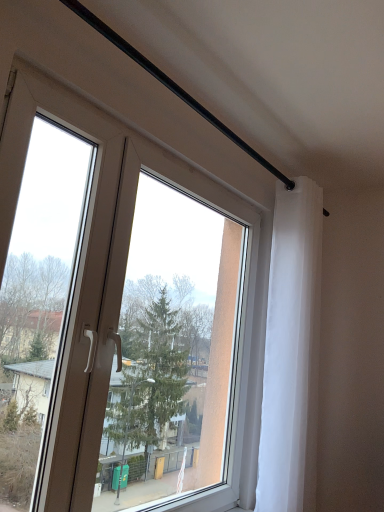
Measure the distance between transparent glass window at center and camera.

The distance of transparent glass window at center from camera is 1.08 meters.

Image resolution: width=384 pixels, height=512 pixels. Identify the location of transparent glass window at center. (122, 284).

What do you see at coordinates (122, 284) in the screenshot? I see `transparent glass window at center` at bounding box center [122, 284].

Based on the photo, what is the approximate width of transparent glass window at center?

transparent glass window at center is 4.57 inches in width.

Describe the element at coordinates (291, 353) in the screenshot. I see `white sheer curtain at upper right` at that location.

Where is `white sheer curtain at upper right`? The image size is (384, 512). white sheer curtain at upper right is located at coordinates (291, 353).

Measure the distance between white sheer curtain at upper right and camera.

white sheer curtain at upper right and camera are 5.76 feet apart from each other.

Image resolution: width=384 pixels, height=512 pixels. Identify the location of transparent glass window at center. (122, 284).

Is white sheer curtain at upper right to the left or to the right of transparent glass window at center in the image?

white sheer curtain at upper right is to the right of transparent glass window at center.

Is white sheer curtain at upper right in front of or behind transparent glass window at center in the image?

white sheer curtain at upper right is behind transparent glass window at center.

Does point (310, 497) lie in front of point (249, 331)?

No, it is behind (249, 331).

From the image's perspective, is white sheer curtain at upper right beneath transparent glass window at center?

Yes, from the image's perspective, white sheer curtain at upper right is beneath transparent glass window at center.

Looking at this image, from a real-world perspective, who is located higher, white sheer curtain at upper right or transparent glass window at center?

white sheer curtain at upper right, from a real-world perspective.

Considering the relative sizes of white sheer curtain at upper right and transparent glass window at center in the image provided, is white sheer curtain at upper right thinner than transparent glass window at center?

No.

Which of these two, white sheer curtain at upper right or transparent glass window at center, stands shorter?

transparent glass window at center.

Looking at the image, does white sheer curtain at upper right seem bigger or smaller compared to transparent glass window at center?

white sheer curtain at upper right is smaller than transparent glass window at center.

Is white sheer curtain at upper right not within transparent glass window at center?

That's correct, white sheer curtain at upper right is outside of transparent glass window at center.

Is white sheer curtain at upper right beside transparent glass window at center?

white sheer curtain at upper right is not next to transparent glass window at center, and they're not touching.

Consider the image. Is transparent glass window at center at the back of white sheer curtain at upper right?

No, white sheer curtain at upper right's orientation is not away from transparent glass window at center.

Find the location of a particular element. window on the left of white sheer curtain at upper right is located at coordinates (122, 284).

Which is more to the left, transparent glass window at center or white sheer curtain at upper right?

transparent glass window at center is more to the left.

From the picture: Is transparent glass window at center behind white sheer curtain at upper right?

No, it is not.

Is point (206, 197) closer or farther from the camera than point (292, 455)?

Point (206, 197) appears to be farther away from the viewer than point (292, 455).

From the image's perspective, relative to white sheer curtain at upper right, is transparent glass window at center above or below?

transparent glass window at center is above white sheer curtain at upper right.

From a real-world perspective, is transparent glass window at center positioned over white sheer curtain at upper right based on gravity?

No.

Does transparent glass window at center have a greater width compared to white sheer curtain at upper right?

No, transparent glass window at center is not wider than white sheer curtain at upper right.

Can you confirm if transparent glass window at center is taller than white sheer curtain at upper right?

Incorrect, the height of transparent glass window at center is not larger of that of white sheer curtain at upper right.

Can you confirm if transparent glass window at center is bigger than white sheer curtain at upper right?

Indeed, transparent glass window at center has a larger size compared to white sheer curtain at upper right.

Is transparent glass window at center outside of white sheer curtain at upper right?

Indeed, transparent glass window at center is completely outside white sheer curtain at upper right.

Looking at this image, are transparent glass window at center and white sheer curtain at upper right located far from each other?

That's not correct — transparent glass window at center is a little close to white sheer curtain at upper right.

From the picture: Could you tell me if transparent glass window at center is facing white sheer curtain at upper right?

Yes.

Looking at this image, how different are the orientations of transparent glass window at center and white sheer curtain at upper right in degrees?

transparent glass window at center and white sheer curtain at upper right are facing 2.39 degrees away from each other.

How much distance is there between transparent glass window at center and white sheer curtain at upper right?

transparent glass window at center and white sheer curtain at upper right are 14.89 inches apart from each other.

The height and width of the screenshot is (512, 384). What are the coordinates of `window above the white sheer curtain at upper right (from the image's perspective)` in the screenshot? It's located at (122, 284).

Find the location of `window in front of the white sheer curtain at upper right`. window in front of the white sheer curtain at upper right is located at coordinates [122, 284].

Find the location of `window located above the white sheer curtain at upper right (from the image's perspective)`. window located above the white sheer curtain at upper right (from the image's perspective) is located at coordinates (122, 284).